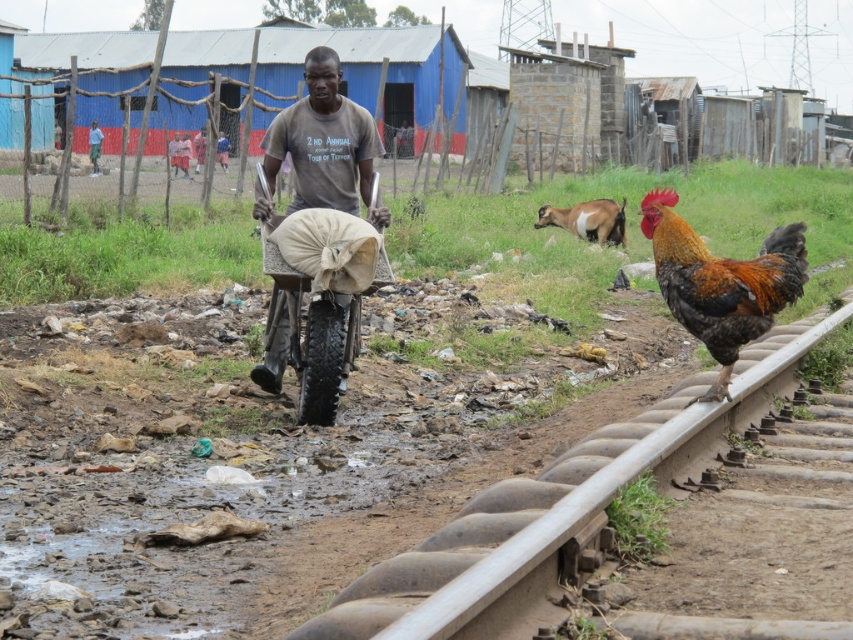
Question: Can you confirm if multicolored feathered rooster at right is thinner than brown and white fur goat at center?

Choices:
 (A) yes
 (B) no

Answer: (A)

Question: Which object appears closest to the camera in this image?

Choices:
 (A) brown metal rail at right
 (B) brown and white fur goat at center
 (C) brown cotton shirt at center
 (D) multicolored feathered rooster at right

Answer: (A)

Question: Which object is closer to the camera taking this photo?

Choices:
 (A) brown metal rail at right
 (B) brown and white fur goat at center

Answer: (A)

Question: Based on their relative distances, which object is farther from the brown metal rail at right?

Choices:
 (A) brown cotton shirt at center
 (B) brown and white fur goat at center

Answer: (B)

Question: Can you confirm if brown metal rail at right is positioned to the left of brown cotton shirt at center?

Choices:
 (A) no
 (B) yes

Answer: (A)

Question: Is brown cotton shirt at center above brown and white fur goat at center?

Choices:
 (A) no
 (B) yes

Answer: (A)